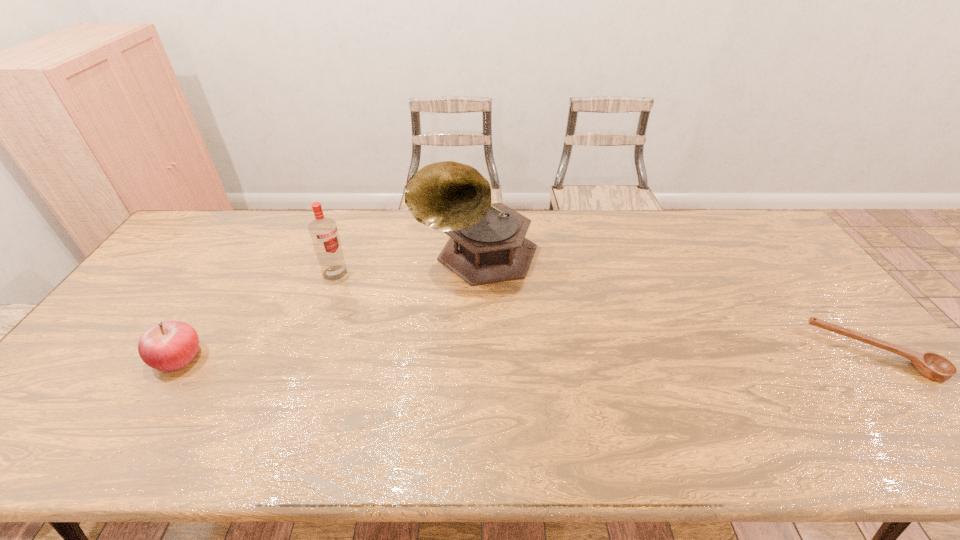
In the image, there is a desktop. Where is `vacant space at the far edge`? This screenshot has width=960, height=540. vacant space at the far edge is located at coordinates (581, 212).

Where is `vacant space at the near edge`? Image resolution: width=960 pixels, height=540 pixels. vacant space at the near edge is located at coordinates (828, 393).

Identify the location of free point at the right edge. The image size is (960, 540). (851, 364).

Locate an element on the screen. This screenshot has height=540, width=960. vacant area at the near left corner of the desktop is located at coordinates (98, 394).

You are a GUI agent. You are given a task and a screenshot of the screen. Output one action in this format:
    pyautogui.click(x=<x>, y=<y>)
    Task: Click on the vacant space at the near right corner of the desktop
    The width and height of the screenshot is (960, 540).
    Given the screenshot: What is the action you would take?
    pyautogui.click(x=848, y=384)

This screenshot has height=540, width=960. Identify the location of vacant area between the rightmost object and the third object from right to left. click(605, 313).

Locate an element on the screen. vacant area between the wooden spoon and the tallest object is located at coordinates (675, 304).

The image size is (960, 540). Find the location of `vacant area that lies between the shortest object and the leftmost object`. vacant area that lies between the shortest object and the leftmost object is located at coordinates (526, 355).

Locate an element on the screen. Image resolution: width=960 pixels, height=540 pixels. free point between the phonograph record and the shortest object is located at coordinates (675, 304).

Image resolution: width=960 pixels, height=540 pixels. I want to click on empty space between the third tallest object and the third shortest object, so click(x=256, y=315).